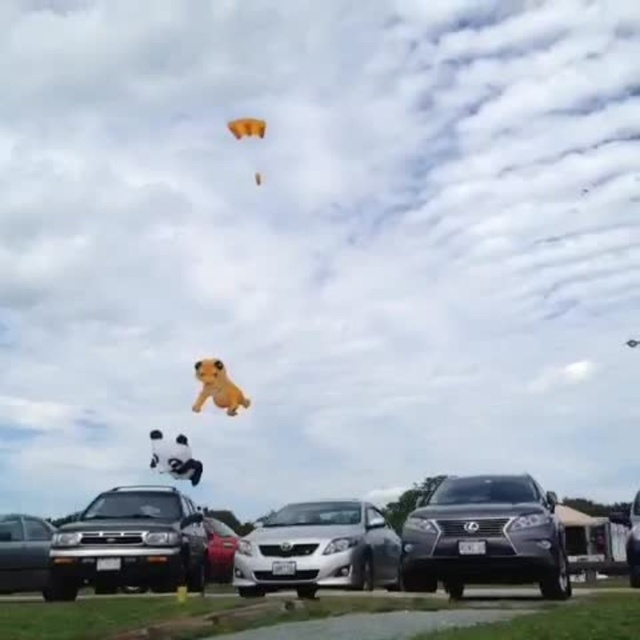
You are a parking attendant trying to direct a driver to their car. The driver mentions they have a matte black suv at center and a silver metallic sedan at center. They want to know which one is closer to the exit located on the right side of the parking lot. Can you help them determine which car is positioned to the right of the other?

The matte black suv at center is to the right of the silver metallic sedan at center, so the matte black suv at center is closer to the exit on the right side.

You are a parking attendant and need to access the matte black sedan at lower left. However, there is a matte black suv at lower left blocking its path. Can you drive the sedan out without moving the SUV?

The matte black suv at lower left is above the matte black sedan at lower left, so the sedan can be driven out without moving the SUV since the SUV is positioned above it and not blocking the front or back.

You are standing at the origin point of the coordinate system in the image. You want to move towards the matte black suv at center. What direction should you move in to reach it?

Since the matte black suv at center is located at coordinate point 0.839 on the x axis and 0.758 on the y axis, you should move towards the northeast direction to reach it.